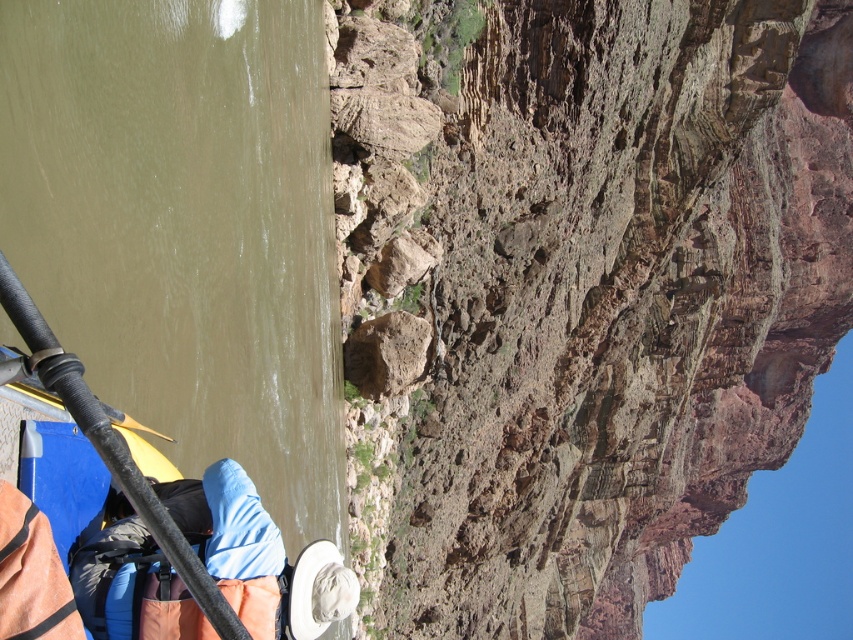
What do you see at coordinates (576, 291) in the screenshot? I see `brown rough cliff at upper right` at bounding box center [576, 291].

Is brown rough cliff at upper right thinner than greenish-brown water at left?

No, brown rough cliff at upper right is not thinner than greenish-brown water at left.

What do you see at coordinates (576, 291) in the screenshot? The height and width of the screenshot is (640, 853). I see `brown rough cliff at upper right` at bounding box center [576, 291].

At what (x,y) coordinates should I click in order to perform the action: click on brown rough cliff at upper right. Please return your answer as a coordinate pair (x, y). The image size is (853, 640). Looking at the image, I should click on (576, 291).